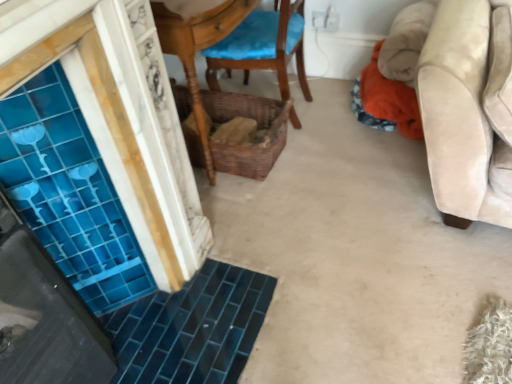
This screenshot has height=384, width=512. Describe the element at coordinates (257, 129) in the screenshot. I see `woven brown basket at center` at that location.

I want to click on woven brown basket at center, so click(x=257, y=129).

What is the approximate width of woven brown basket at center?

It is 59.55 centimeters.

What is the approximate width of wooden chair with blue cushion at center?

20.39 inches.

You are a GUI agent. You are given a task and a screenshot of the screen. Output one action in this format:
    pyautogui.click(x=<x>, y=<y>)
    Task: Click on the wooden chair with blue cushion at center
    
    Given the screenshot: What is the action you would take?
    pyautogui.click(x=262, y=47)

Describe the element at coordinates (262, 47) in the screenshot. Image resolution: width=512 pixels, height=384 pixels. I see `wooden chair with blue cushion at center` at that location.

At what (x,y) coordinates should I click in order to perform the action: click on woven brown basket at center. Please return your answer as a coordinate pair (x, y). The height and width of the screenshot is (384, 512). Looking at the image, I should click on (257, 129).

Considering the positions of objects woven brown basket at center and wooden chair with blue cushion at center in the image provided, who is more to the right, woven brown basket at center or wooden chair with blue cushion at center?

wooden chair with blue cushion at center is more to the right.

Between woven brown basket at center and wooden chair with blue cushion at center, which one is positioned in front?

wooden chair with blue cushion at center is more forward.

Which point is more forward, (251, 111) or (284, 30)?

The point (284, 30) is more forward.

From the image's perspective, which one is positioned lower, woven brown basket at center or wooden chair with blue cushion at center?

woven brown basket at center is shown below in the image.

From a real-world perspective, is woven brown basket at center physically located above or below wooden chair with blue cushion at center?

woven brown basket at center is situated lower than wooden chair with blue cushion at center in the real world.

Which of these two, woven brown basket at center or wooden chair with blue cushion at center, is thinner?

wooden chair with blue cushion at center is thinner.

Who is taller, woven brown basket at center or wooden chair with blue cushion at center?

wooden chair with blue cushion at center.

Who is smaller, woven brown basket at center or wooden chair with blue cushion at center?

With smaller size is woven brown basket at center.

Is woven brown basket at center outside of wooden chair with blue cushion at center?

woven brown basket at center lies outside wooden chair with blue cushion at center's area.

Are woven brown basket at center and wooden chair with blue cushion at center located far from each other?

No, woven brown basket at center is not far away from wooden chair with blue cushion at center.

Could you tell me if woven brown basket at center is facing wooden chair with blue cushion at center?

No, woven brown basket at center does not turn towards wooden chair with blue cushion at center.

Locate an element on the screen. basket behind the wooden chair with blue cushion at center is located at coordinates (257, 129).

Does wooden chair with blue cushion at center appear on the right side of woven brown basket at center?

Correct, you'll find wooden chair with blue cushion at center to the right of woven brown basket at center.

Considering the positions of objects wooden chair with blue cushion at center and woven brown basket at center in the image provided, who is behind, wooden chair with blue cushion at center or woven brown basket at center?

woven brown basket at center.

Is point (229, 59) closer to viewer compared to point (223, 97)?

Yes, point (229, 59) is in front of point (223, 97).

From the image's perspective, relative to woven brown basket at center, is wooden chair with blue cushion at center above or below?

Based on their image positions, wooden chair with blue cushion at center is located above woven brown basket at center.

From a real-world perspective, is wooden chair with blue cushion at center positioned above or below woven brown basket at center?

wooden chair with blue cushion at center is situated higher than woven brown basket at center in the real world.

Considering the relative sizes of wooden chair with blue cushion at center and woven brown basket at center in the image provided, is wooden chair with blue cushion at center thinner than woven brown basket at center?

Yes, wooden chair with blue cushion at center is thinner than woven brown basket at center.

In the scene shown: Considering the relative sizes of wooden chair with blue cushion at center and woven brown basket at center in the image provided, is wooden chair with blue cushion at center shorter than woven brown basket at center?

No.

Can you confirm if wooden chair with blue cushion at center is bigger than woven brown basket at center?

Yes, wooden chair with blue cushion at center is bigger than woven brown basket at center.

Consider the image. Is wooden chair with blue cushion at center not inside woven brown basket at center?

Yes, wooden chair with blue cushion at center is outside of woven brown basket at center.

Is wooden chair with blue cushion at center not close to woven brown basket at center?

No, wooden chair with blue cushion at center is not far away from woven brown basket at center.

Is wooden chair with blue cushion at center facing towards woven brown basket at center?

No, wooden chair with blue cushion at center is not turned towards woven brown basket at center.

What's the angular difference between wooden chair with blue cushion at center and woven brown basket at center's facing directions?

They differ by 175 degrees in their facing directions.

In the scene shown: How distant is wooden chair with blue cushion at center from woven brown basket at center?

wooden chair with blue cushion at center is 9.40 inches from woven brown basket at center.

Image resolution: width=512 pixels, height=384 pixels. I want to click on chair that is in front of the woven brown basket at center, so click(262, 47).

At what (x,y) coordinates should I click in order to perform the action: click on basket below the wooden chair with blue cushion at center (from a real-world perspective). Please return your answer as a coordinate pair (x, y). This screenshot has width=512, height=384. Looking at the image, I should click on (257, 129).

This screenshot has width=512, height=384. What are the coordinates of `basket on the left side of wooden chair with blue cushion at center` in the screenshot? It's located at (257, 129).